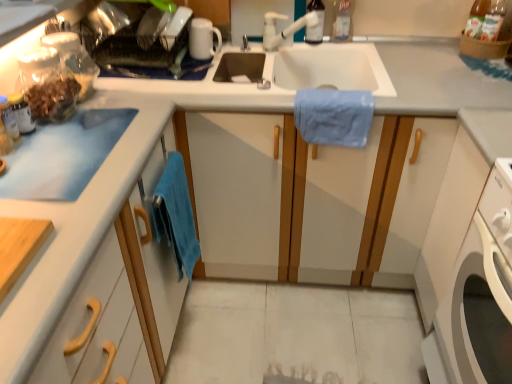
The image size is (512, 384). What are the coordinates of `empty space that is ontop of white matte cabinet at left (from a real-world perspective)` in the screenshot? It's located at (66, 172).